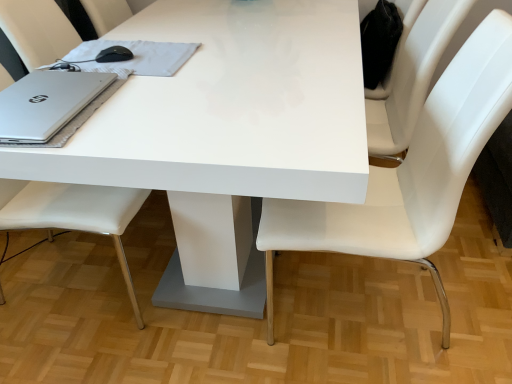
Question: Considering the relative positions of satin silver notebook at upper left and white leather chair at center, which is the second chair in left-to-right order, in the image provided, is satin silver notebook at upper left to the left of white leather chair at center, which is the second chair in left-to-right order, from the viewer's perspective?

Choices:
 (A) yes
 (B) no

Answer: (A)

Question: Is there a large distance between satin silver notebook at upper left and white leather chair at center, positioned as the first chair in right-to-left order?

Choices:
 (A) yes
 (B) no

Answer: (B)

Question: Is white leather chair at center, positioned as the first chair in right-to-left order, a part of satin silver notebook at upper left?

Choices:
 (A) yes
 (B) no

Answer: (B)

Question: From the image's perspective, would you say satin silver notebook at upper left is positioned over white leather chair at center, positioned as the first chair in right-to-left order?

Choices:
 (A) no
 (B) yes

Answer: (B)

Question: Does satin silver notebook at upper left come behind white leather chair at center, which is the second chair in left-to-right order?

Choices:
 (A) yes
 (B) no

Answer: (A)

Question: Is satin silver notebook at upper left oriented away from white leather chair at center, which is the second chair in left-to-right order?

Choices:
 (A) yes
 (B) no

Answer: (B)

Question: Can silver metallic laptop at left be found inside white leather chair at center, which is the second chair in left-to-right order?

Choices:
 (A) no
 (B) yes

Answer: (A)

Question: From a real-world perspective, is white leather chair at center, positioned as the first chair in right-to-left order, physically below silver metallic laptop at left?

Choices:
 (A) no
 (B) yes

Answer: (B)

Question: Is white leather chair at center, positioned as the first chair in right-to-left order, placed right next to silver metallic laptop at left?

Choices:
 (A) yes
 (B) no

Answer: (B)

Question: Are white leather chair at center, which is the second chair in left-to-right order, and silver metallic laptop at left located far from each other?

Choices:
 (A) yes
 (B) no

Answer: (B)

Question: Considering the relative positions of white leather chair at center, which is the second chair in left-to-right order, and silver metallic laptop at left in the image provided, is white leather chair at center, which is the second chair in left-to-right order, to the left of silver metallic laptop at left from the viewer's perspective?

Choices:
 (A) no
 (B) yes

Answer: (A)

Question: Is white leather chair at center, positioned as the first chair in right-to-left order, shorter than silver metallic laptop at left?

Choices:
 (A) yes
 (B) no

Answer: (B)

Question: Is white leather chair at left, which ranks as the second chair in right-to-left order, thinner than white glossy table at center?

Choices:
 (A) no
 (B) yes

Answer: (B)